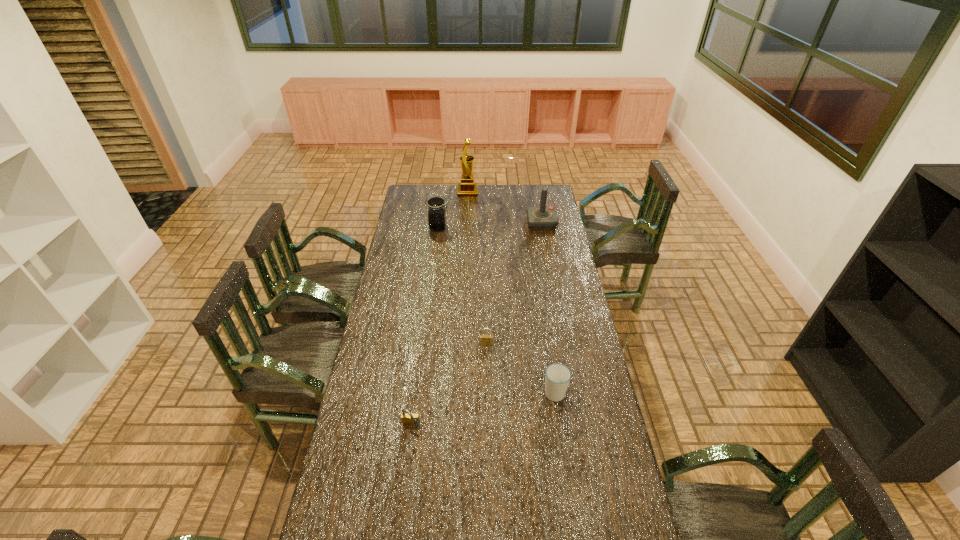
Where is `the fourth object from right to left`? The width and height of the screenshot is (960, 540). the fourth object from right to left is located at coordinates (467, 188).

Where is `award`? Image resolution: width=960 pixels, height=540 pixels. award is located at coordinates (467, 188).

Where is `the fifth shortest object`? the fifth shortest object is located at coordinates (542, 217).

In order to click on jar in this screenshot , I will do `click(437, 212)`.

Identify the location of cup. The image size is (960, 540). (557, 376).

The width and height of the screenshot is (960, 540). What are the coordinates of `the left padlock` in the screenshot? It's located at (409, 419).

Where is `the nearer padlock`? the nearer padlock is located at coordinates (409, 419).

Locate an element on the screen. Image resolution: width=960 pixels, height=540 pixels. the third nearest object is located at coordinates (483, 339).

At what (x,y) coordinates should I click in order to perform the action: click on the right padlock. Please return your answer as a coordinate pair (x, y). The height and width of the screenshot is (540, 960). Looking at the image, I should click on (483, 339).

The height and width of the screenshot is (540, 960). In order to click on vacant space located on the front-facing side of the award in this screenshot , I will do `click(495, 192)`.